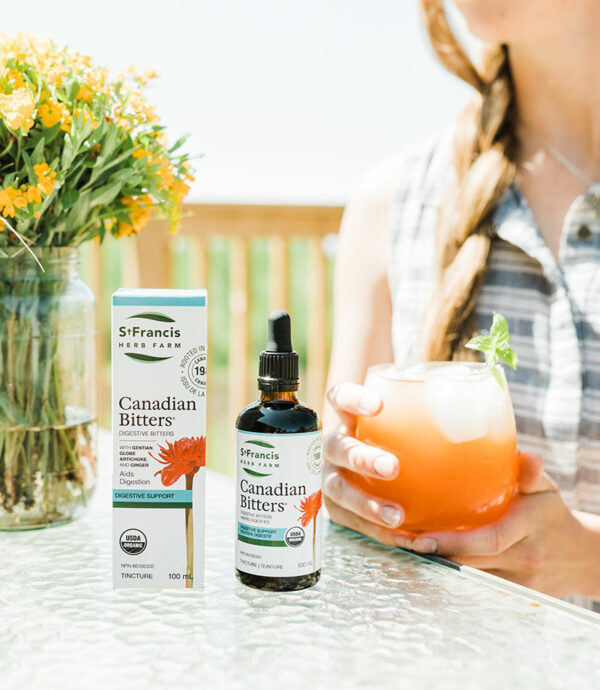
Find the location of a particular element. Image resolution: width=600 pixels, height=690 pixels. table is located at coordinates (259, 615).